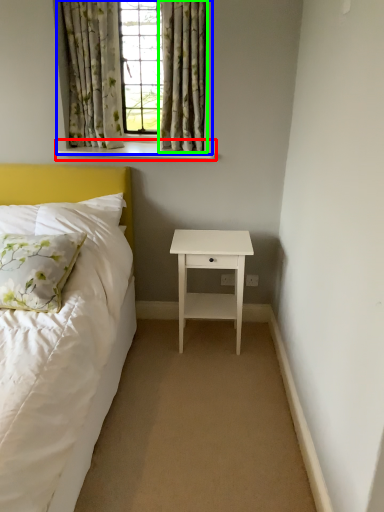
Question: Which object is positioned farthest from window sill (highlighted by a red box)? Select from window (highlighted by a blue box) and curtain (highlighted by a green box).

Choices:
 (A) window
 (B) curtain

Answer: (B)